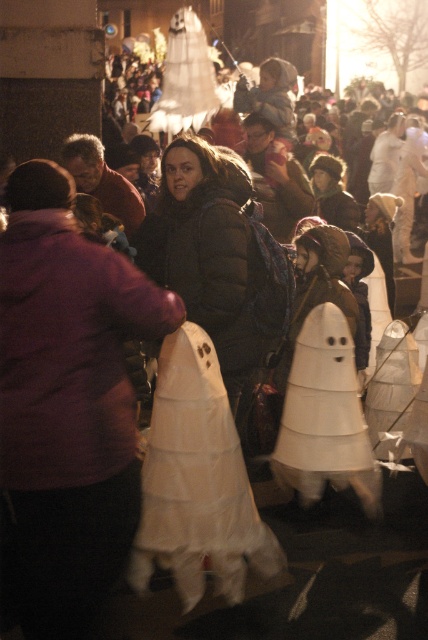
Consider the image. Does white paper ghost at center have a larger size compared to white paper cone at center?

No.

Does white paper ghost at center appear on the right side of white paper cone at center?

Incorrect, white paper ghost at center is not on the right side of white paper cone at center.

Between point (219, 577) and point (315, 355), which one is positioned in front?

Point (219, 577) is more forward.

Where is `white paper ghost at center`? The height and width of the screenshot is (640, 428). white paper ghost at center is located at coordinates pos(196,481).